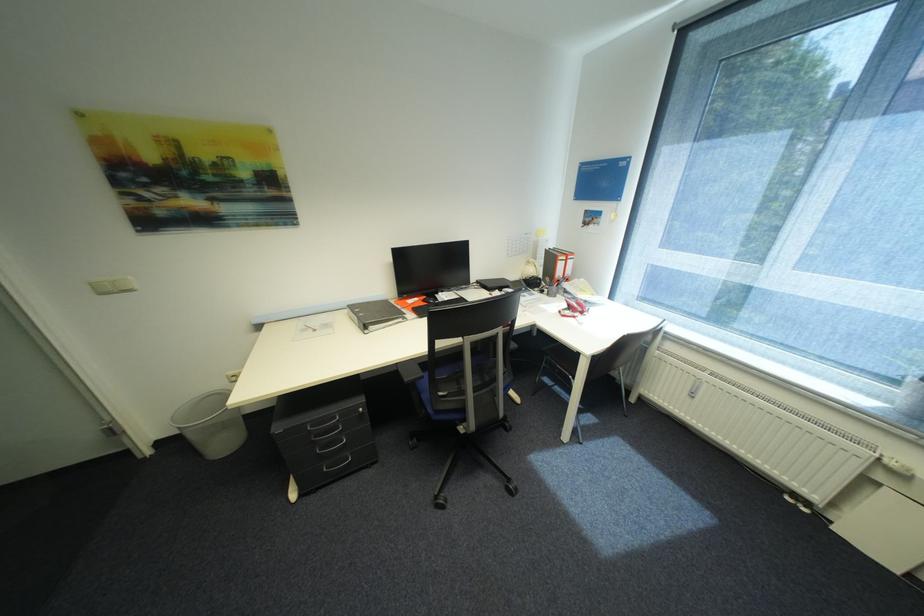
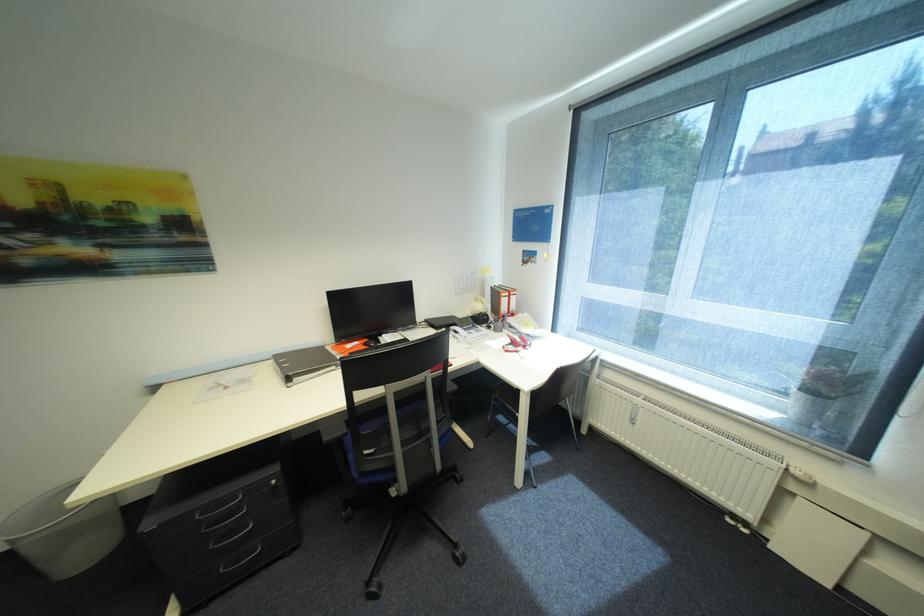
Find the pixel in the second image that matches point 342,429 in the first image.

(242, 512)